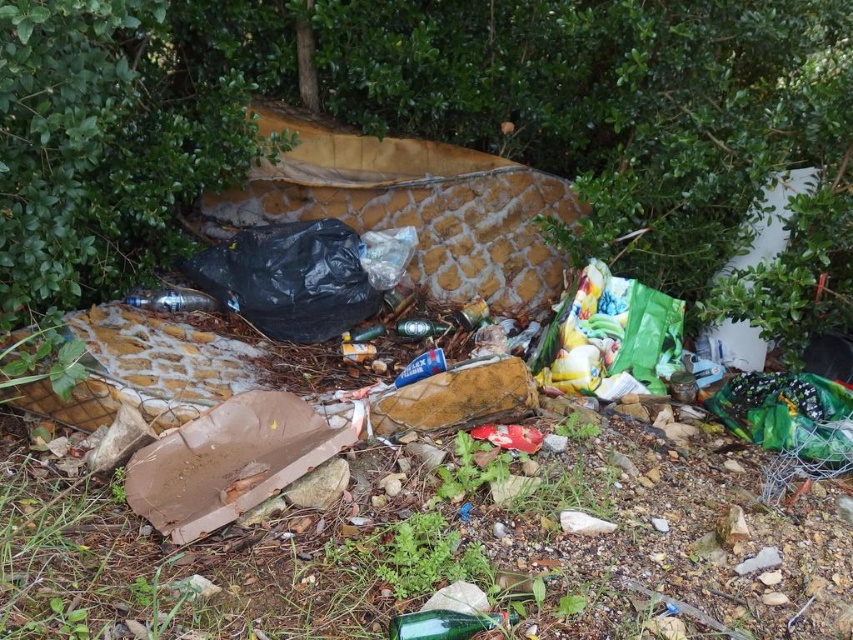
Question: Where is black plastic bag at center located in relation to green matte bottle at center in the image?

Choices:
 (A) above
 (B) below

Answer: (A)

Question: Considering the real-world distances, which object is farthest from the green glass bottle at lower center?

Choices:
 (A) black plastic bag at center
 (B) green leafy bush at upper left
 (C) green matte bottle at center
 (D) translucent plastic bottle at center

Answer: (D)

Question: Estimate the real-world distances between objects in this image. Which object is farther from the green matte bottle at center?

Choices:
 (A) black plastic bag at center
 (B) green leafy bush at upper left
 (C) green glass bottle at lower center

Answer: (C)

Question: Does green glass bottle at lower center lie in front of translucent plastic bottle at center?

Choices:
 (A) no
 (B) yes

Answer: (B)

Question: Among these objects, which one is farthest from the camera?

Choices:
 (A) green matte bottle at center
 (B) green glass bottle at lower center
 (C) black plastic bag at center

Answer: (A)

Question: Can you confirm if green leafy bush at upper left is smaller than translucent plastic bottle at center?

Choices:
 (A) no
 (B) yes

Answer: (A)